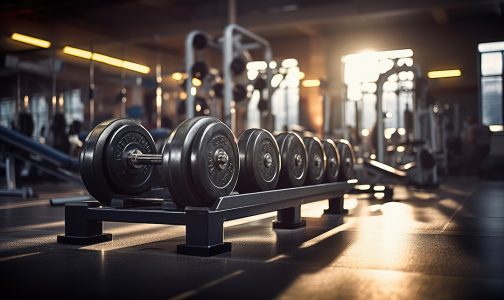
This screenshot has height=300, width=504. I want to click on mirror panel, so click(6, 86), click(32, 89), click(78, 97), click(108, 104), click(134, 94), click(169, 112), click(209, 111).